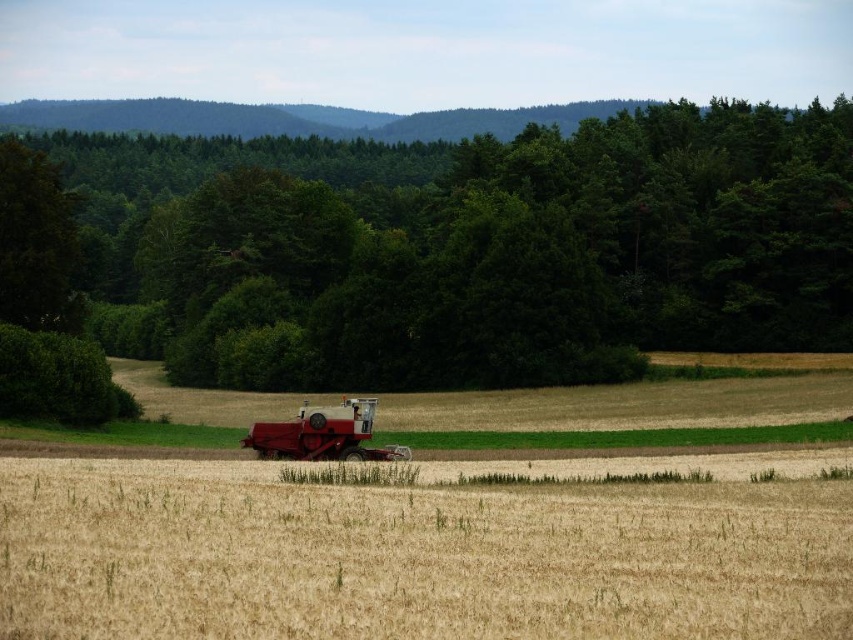
You are a farmer standing at the edge of your property and want to check both the green leafy tree at center and the golden grain field at center. Which object will you encounter first as you walk towards the center of the field?

You will encounter the green leafy tree at center first because it is closer to you than the golden grain field at center, which is further away.

You are a farmer who wants to know if the metallic red combine at center can move freely within the golden grain field at center. Based on their sizes, can it?

The golden grain field at center is bigger than metallic red combine at center, so yes, the metallic red combine at center can move freely within the golden grain field at center since the field is larger in size.